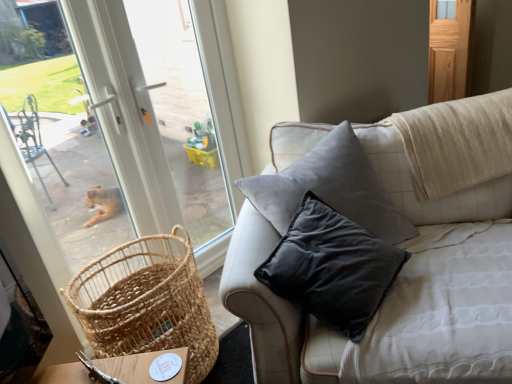
What is the approximate height of velvet grey pillow at upper right?

velvet grey pillow at upper right is 34.47 inches in height.

This screenshot has height=384, width=512. Describe the element at coordinates (146, 302) in the screenshot. I see `woven natural basket at lower left` at that location.

Where is `velvet grey pillow at upper right`? Image resolution: width=512 pixels, height=384 pixels. velvet grey pillow at upper right is located at coordinates (408, 263).

Is woven natural basket at lower left thinner than wooden screen door at upper right?

In fact, woven natural basket at lower left might be wider than wooden screen door at upper right.

Considering the sizes of objects woven natural basket at lower left and wooden screen door at upper right in the image provided, who is bigger, woven natural basket at lower left or wooden screen door at upper right?

With larger size is woven natural basket at lower left.

From a real-world perspective, between woven natural basket at lower left and wooden screen door at upper right, who is vertically higher?

In real-world perspective, wooden screen door at upper right is above.

Does point (197, 308) come behind point (462, 81)?

No, it is in front of (462, 81).

Is velvet grey pillow at upper right positioned behind woven natural basket at lower left?

No, velvet grey pillow at upper right is closer to the camera.

Locate an element on the screen. Image resolution: width=512 pixels, height=384 pixels. studio couch that is above the woven natural basket at lower left (from a real-world perspective) is located at coordinates (408, 263).

Considering the points (494, 92) and (132, 342), which point is behind, point (494, 92) or point (132, 342)?

Point (494, 92)

From the image's perspective, which one is positioned lower, velvet grey pillow at upper right or woven natural basket at lower left?

woven natural basket at lower left, from the image's perspective.

Considering the relative sizes of woven natural basket at lower left and velvet grey pillow at upper right in the image provided, is woven natural basket at lower left shorter than velvet grey pillow at upper right?

Correct, woven natural basket at lower left is not as tall as velvet grey pillow at upper right.

Is point (104, 318) positioned after point (388, 365)?

Yes, it is behind point (388, 365).

Which object is closer to the camera, woven natural basket at lower left or velvet grey pillow at upper right?

velvet grey pillow at upper right.

Is wooden screen door at upper right to the right of velvet grey pillow at upper right from the viewer's perspective?

Indeed, wooden screen door at upper right is positioned on the right side of velvet grey pillow at upper right.

From the image's perspective, is wooden screen door at upper right below velvet grey pillow at upper right?

Actually, wooden screen door at upper right appears above velvet grey pillow at upper right in the image.

The image size is (512, 384). I want to click on screen door located on the right of velvet grey pillow at upper right, so click(x=449, y=49).

Is wooden screen door at upper right positioned beyond the bounds of velvet grey pillow at upper right?

wooden screen door at upper right lies outside velvet grey pillow at upper right's area.

How different are the orientations of velvet grey pillow at upper right and wooden screen door at upper right in degrees?

45.5 degrees separate the facing orientations of velvet grey pillow at upper right and wooden screen door at upper right.

Is wooden screen door at upper right a part of velvet grey pillow at upper right?

No, wooden screen door at upper right is not a part of velvet grey pillow at upper right.

Considering the positions of objects velvet grey pillow at upper right and wooden screen door at upper right in the image provided, who is more to the right, velvet grey pillow at upper right or wooden screen door at upper right?

wooden screen door at upper right is more to the right.

Which is in front, point (455, 216) or point (431, 82)?

The point (455, 216) is closer to the camera.

Is wooden screen door at upper right located outside woven natural basket at lower left?

Yes, wooden screen door at upper right is outside of woven natural basket at lower left.

Does point (452, 1) come in front of point (193, 367)?

No, (452, 1) is behind (193, 367).

Where is `picnic basket on the left of wooden screen door at upper right`? The width and height of the screenshot is (512, 384). picnic basket on the left of wooden screen door at upper right is located at coordinates (146, 302).

From a real-world perspective, is wooden screen door at upper right physically above woven natural basket at lower left?

Yes, from a real-world perspective, wooden screen door at upper right is over woven natural basket at lower left

Find the location of `picnic basket below the wooden screen door at upper right (from a real-world perspective)`. picnic basket below the wooden screen door at upper right (from a real-world perspective) is located at coordinates (146, 302).

The width and height of the screenshot is (512, 384). Find the location of `studio couch located above the woven natural basket at lower left (from the image's perspective)`. studio couch located above the woven natural basket at lower left (from the image's perspective) is located at coordinates tap(408, 263).

From the image, which object appears to be farther from wooden screen door at upper right, woven natural basket at lower left or velvet grey pillow at upper right?

woven natural basket at lower left is positioned further to the anchor wooden screen door at upper right.

Considering their positions, is wooden screen door at upper right positioned closer to velvet grey pillow at upper right than woven natural basket at lower left?

woven natural basket at lower left lies closer to velvet grey pillow at upper right than the other object.

From the image, which object appears to be farther from woven natural basket at lower left, wooden screen door at upper right or velvet grey pillow at upper right?

Among the two, wooden screen door at upper right is located further to woven natural basket at lower left.

Estimate the real-world distances between objects in this image. Which object is closer to wooden screen door at upper right, velvet grey pillow at upper right or woven natural basket at lower left?

Based on the image, velvet grey pillow at upper right appears to be nearer to wooden screen door at upper right.

When comparing their distances from woven natural basket at lower left, does velvet grey pillow at upper right or wooden screen door at upper right seem further?

wooden screen door at upper right.

Considering their positions, is woven natural basket at lower left positioned closer to velvet grey pillow at upper right than wooden screen door at upper right?

Among the two, woven natural basket at lower left is located nearer to velvet grey pillow at upper right.

Locate an element on the screen. picnic basket located between velvet grey pillow at upper right and wooden screen door at upper right in the depth direction is located at coordinates (146, 302).